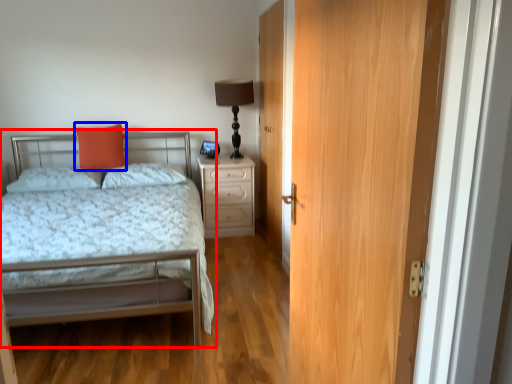
Question: Which object is closer to the camera taking this photo, bed (highlighted by a red box) or throw pillow (highlighted by a blue box)?

Choices:
 (A) bed
 (B) throw pillow

Answer: (A)